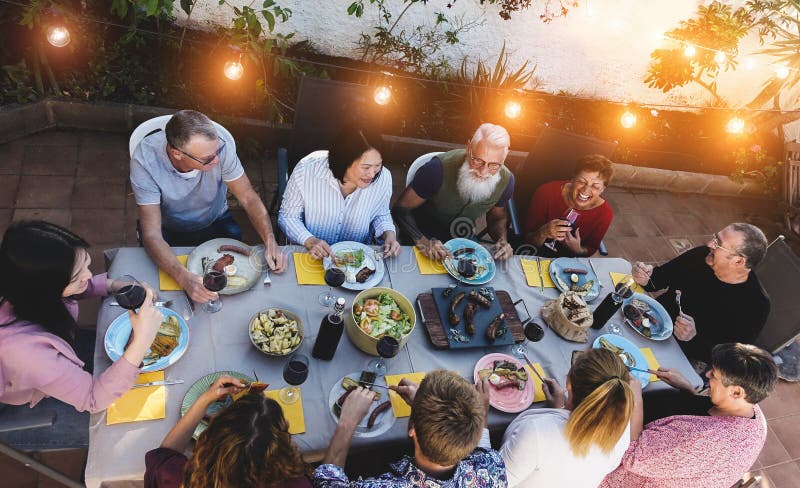
Locate an element on the screen. plates is located at coordinates (182, 346), (234, 290), (352, 285), (493, 270), (558, 258), (658, 304), (641, 355), (526, 397), (378, 430), (194, 390).